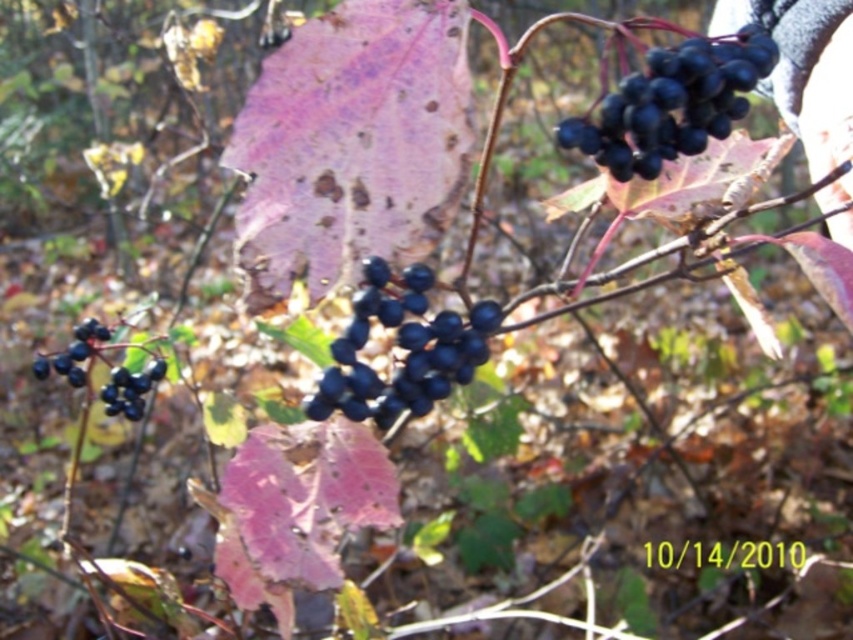
Question: Is shiny dark blue berries at lower left to the left of shiny dark blue berries at center-left from the viewer's perspective?

Choices:
 (A) no
 (B) yes

Answer: (B)

Question: Which of the following is the farthest from the observer?

Choices:
 (A) (131, 408)
 (B) (328, 385)

Answer: (A)

Question: Which object is the closest to the shiny dark blue berries at center-left?

Choices:
 (A) shiny black berries at upper right
 (B) glossy dark blue berries at center

Answer: (B)

Question: Is glossy dark blue berries at center to the left of shiny dark blue berries at lower left from the viewer's perspective?

Choices:
 (A) yes
 (B) no

Answer: (B)

Question: Is glossy dark blue berries at center positioned at the back of shiny dark blue berries at lower left?

Choices:
 (A) no
 (B) yes

Answer: (A)

Question: Which object appears closest to the camera in this image?

Choices:
 (A) shiny dark blue berries at lower left
 (B) glossy dark blue berries at center
 (C) shiny black berries at upper right
 (D) shiny dark blue berries at center-left

Answer: (C)